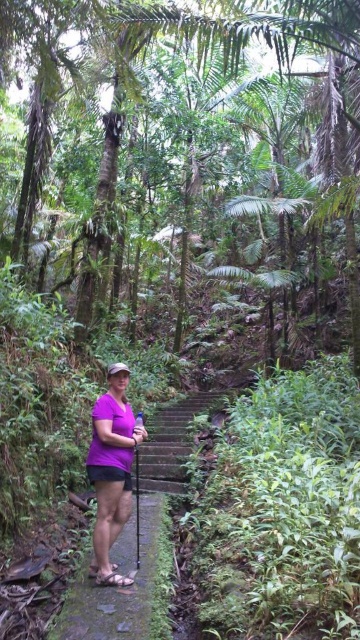
Question: Does brown stone trail at center appear under purple matte shirt at center?

Choices:
 (A) yes
 (B) no

Answer: (A)

Question: Is brown stone trail at center above purple matte shirt at center?

Choices:
 (A) yes
 (B) no

Answer: (B)

Question: Considering the relative positions of brown stone trail at center and purple matte shirt at center in the image provided, where is brown stone trail at center located with respect to purple matte shirt at center?

Choices:
 (A) right
 (B) left

Answer: (A)